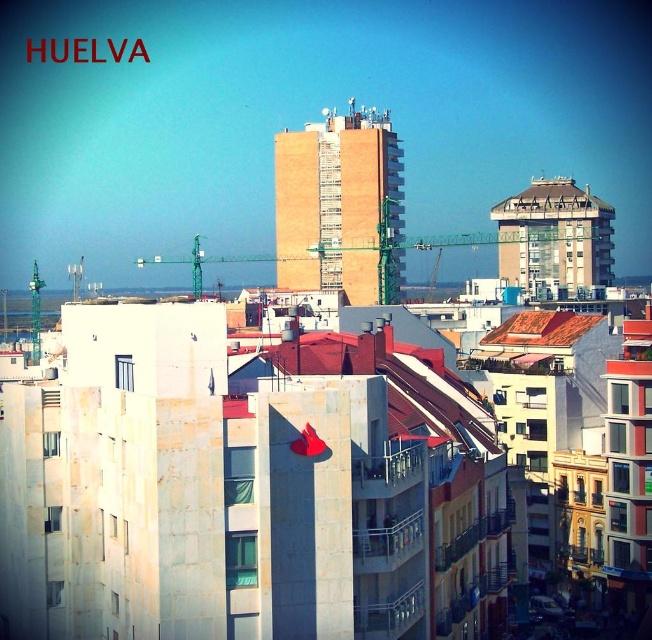
Question: Can you confirm if concrete building at center is positioned below white textured roof at upper right?

Choices:
 (A) yes
 (B) no

Answer: (A)

Question: Which object appears closest to the camera in this image?

Choices:
 (A) concrete building at center
 (B) white textured roof at upper right

Answer: (A)

Question: Is concrete building at center wider than white textured roof at upper right?

Choices:
 (A) yes
 (B) no

Answer: (A)

Question: Observing the image, what is the correct spatial positioning of concrete building at center in reference to white textured roof at upper right?

Choices:
 (A) left
 (B) right

Answer: (A)

Question: Which point is closer to the camera?

Choices:
 (A) concrete building at center
 (B) brown brick building at center
 (C) white textured roof at upper right

Answer: (A)

Question: Which point is farther from the camera taking this photo?

Choices:
 (A) (376, 241)
 (B) (542, 195)
 (C) (587, 252)

Answer: (A)